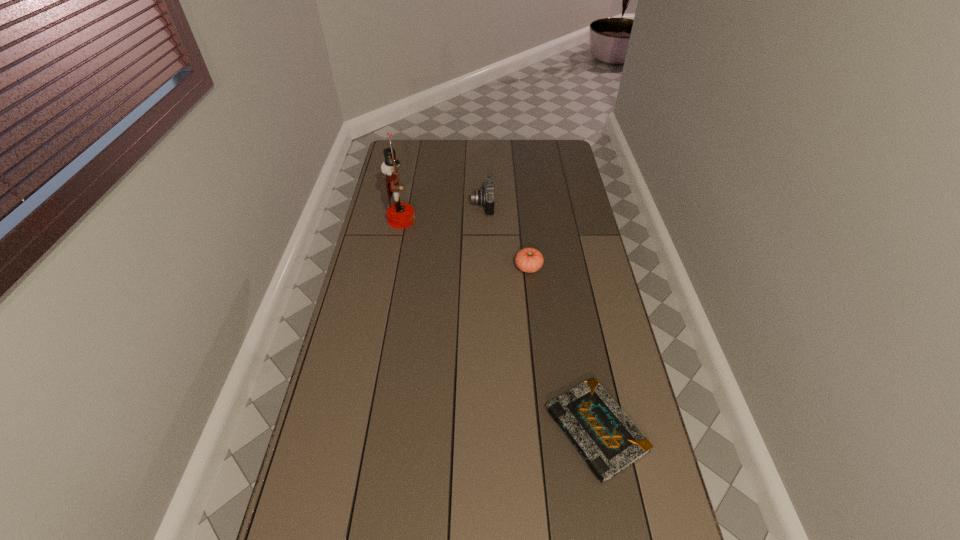
Locate an element on the screen. The image size is (960, 540). unoccupied area between the leftmost object and the third object from right to left is located at coordinates (443, 212).

At what (x,y) coordinates should I click in order to perform the action: click on vacant area that lies between the third tallest object and the leftmost object. Please return your answer as a coordinate pair (x, y). Looking at the image, I should click on (466, 244).

Image resolution: width=960 pixels, height=540 pixels. Find the location of `free area in between the tomato and the notebook`. free area in between the tomato and the notebook is located at coordinates (563, 348).

Where is `vacant region between the nearest object and the second tallest object`? The height and width of the screenshot is (540, 960). vacant region between the nearest object and the second tallest object is located at coordinates (540, 317).

Image resolution: width=960 pixels, height=540 pixels. In order to click on free space between the second shortest object and the leftmost object in this screenshot , I will do `click(466, 244)`.

You are a GUI agent. You are given a task and a screenshot of the screen. Output one action in this format:
    pyautogui.click(x=<x>, y=<y>)
    Task: Click on the object that is the closest to the third farthest object
    This screenshot has height=540, width=960.
    Given the screenshot: What is the action you would take?
    pyautogui.click(x=485, y=197)

Locate an element on the screen. This screenshot has height=540, width=960. object that is the second nearest to the shortest object is located at coordinates (485, 197).

You are a GUI agent. You are given a task and a screenshot of the screen. Output one action in this format:
    pyautogui.click(x=<x>, y=<y>)
    Task: Click on the vacant region that satisfies the following two spatial constraints: 1. on the front-facing side of the leftmost object; 2. on the right side of the shortest object
    This screenshot has height=540, width=960.
    Given the screenshot: What is the action you would take?
    pyautogui.click(x=361, y=430)

Identify the location of free spot that satisfies the following two spatial constraints: 1. on the front-facing side of the nutcracker; 2. on the left side of the nearest object. The height and width of the screenshot is (540, 960). (361, 430).

The image size is (960, 540). In order to click on vacant space that satisfies the following two spatial constraints: 1. on the front-facing side of the camera; 2. on the left side of the nearest object in this screenshot , I will do `click(484, 430)`.